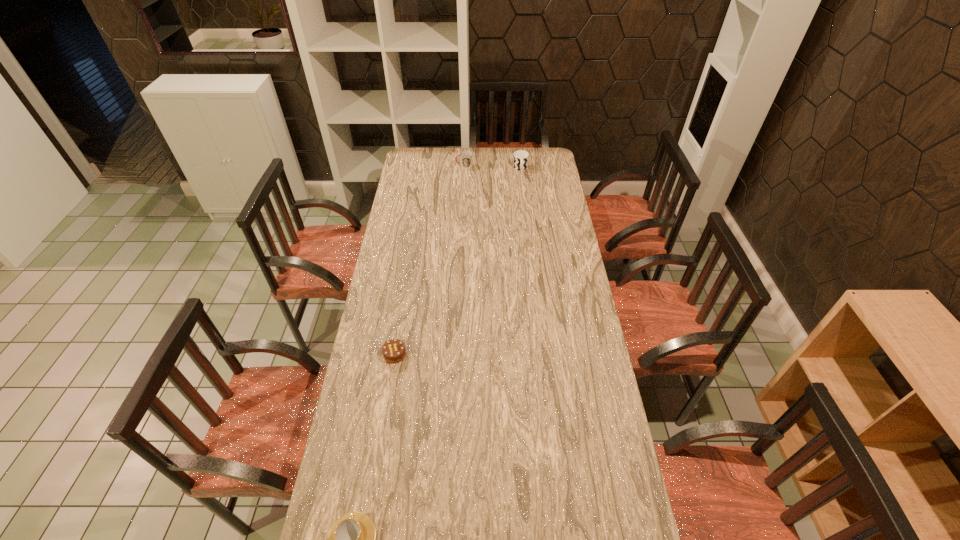
Image resolution: width=960 pixels, height=540 pixels. Identify the location of vacant space that satisfies the following two spatial constraints: 1. on the back side of the chocolate cake; 2. on the side of the second cup from left to right where the handle is located. (425, 166).

This screenshot has width=960, height=540. What are the coordinates of `vacant space that satisfies the following two spatial constraints: 1. on the back side of the chocolate cake; 2. on the side of the second cup from left to right where the handle is located` in the screenshot? It's located at tap(425, 166).